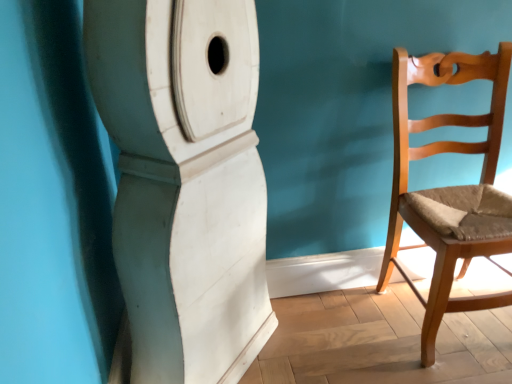
Question: Considering the positions of light brown wood chair at right and white matte pillar at center in the image, is light brown wood chair at right bigger or smaller than white matte pillar at center?

Choices:
 (A) big
 (B) small

Answer: (B)

Question: In the image, is light brown wood chair at right positioned in front of or behind white matte pillar at center?

Choices:
 (A) front
 (B) behind

Answer: (B)

Question: From a real-world perspective, relative to white matte pillar at center, is light brown wood chair at right vertically above or below?

Choices:
 (A) above
 (B) below

Answer: (B)

Question: Is white matte pillar at center to the left or to the right of light brown wood chair at right in the image?

Choices:
 (A) right
 (B) left

Answer: (B)

Question: Based on their sizes in the image, would you say white matte pillar at center is bigger or smaller than light brown wood chair at right?

Choices:
 (A) small
 (B) big

Answer: (B)

Question: From the image's perspective, is white matte pillar at center located above or below light brown wood chair at right?

Choices:
 (A) below
 (B) above

Answer: (A)

Question: Would you say white matte pillar at center is inside or outside light brown wood chair at right?

Choices:
 (A) inside
 (B) outside

Answer: (B)